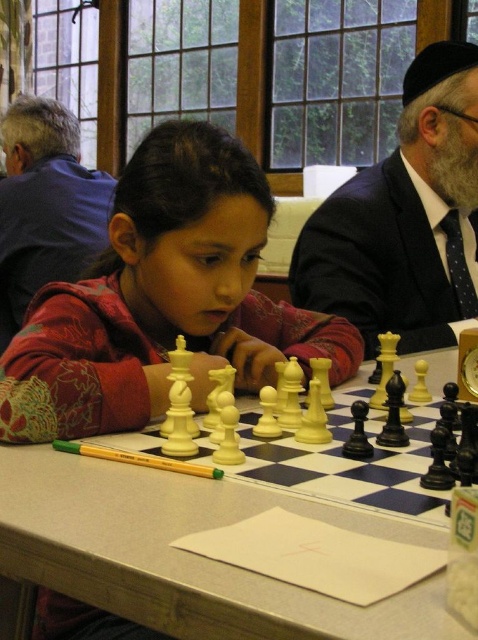
Question: Can you confirm if matte plastic chess pieces at center is positioned to the left of white glossy chessboard at center?

Choices:
 (A) yes
 (B) no

Answer: (A)

Question: Among these points, which one is nearest to the camera?

Choices:
 (A) (440, 84)
 (B) (253, 636)

Answer: (B)

Question: Is matte plastic chess pieces at center wider than dark suit at center?

Choices:
 (A) no
 (B) yes

Answer: (B)

Question: Observing the image, what is the correct spatial positioning of matte plastic chess pieces at center in reference to white glossy chessboard at center?

Choices:
 (A) right
 (B) left

Answer: (B)

Question: Which object appears farthest from the camera in this image?

Choices:
 (A) matte plastic chess pieces at center
 (B) matte blue shirt at upper left
 (C) white glossy chessboard at center
 (D) dark suit at center

Answer: (B)

Question: Among these points, which one is nearest to the camera?

Choices:
 (A) (305, 228)
 (B) (317, 502)
 (C) (60, 192)

Answer: (B)